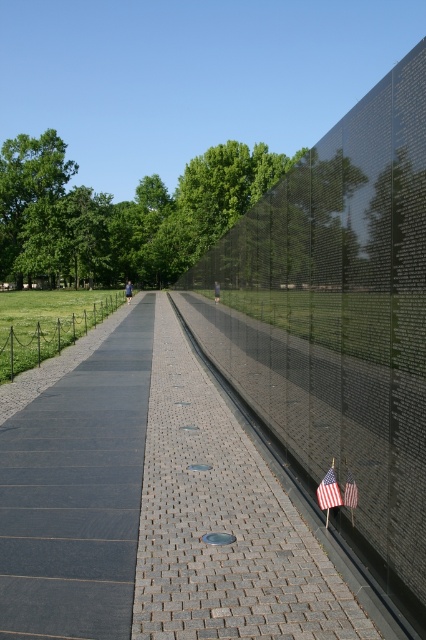
Question: Which of the following is the closest to the observer?

Choices:
 (A) (43, 330)
 (B) (158, 426)
 (C) (414, 198)
 (D) (135, 356)

Answer: (C)

Question: Which object appears farthest from the camera in this image?

Choices:
 (A) american flag at lower right
 (B) american flag at center

Answer: (B)

Question: Is dark gray paving stone at center positioned in front of american flag at lower right?

Choices:
 (A) yes
 (B) no

Answer: (A)

Question: Is gray brick pavement at center positioned behind dark gray paving stone at center?

Choices:
 (A) yes
 (B) no

Answer: (B)

Question: Which of the following is the closest to the observer?

Choices:
 (A) dark gray paving stone at center
 (B) gray brick pavement at center
 (C) black wire fence at left
 (D) american flag at lower right

Answer: (B)

Question: Does gray brick pavement at center appear over black glass wall at center?

Choices:
 (A) no
 (B) yes

Answer: (A)